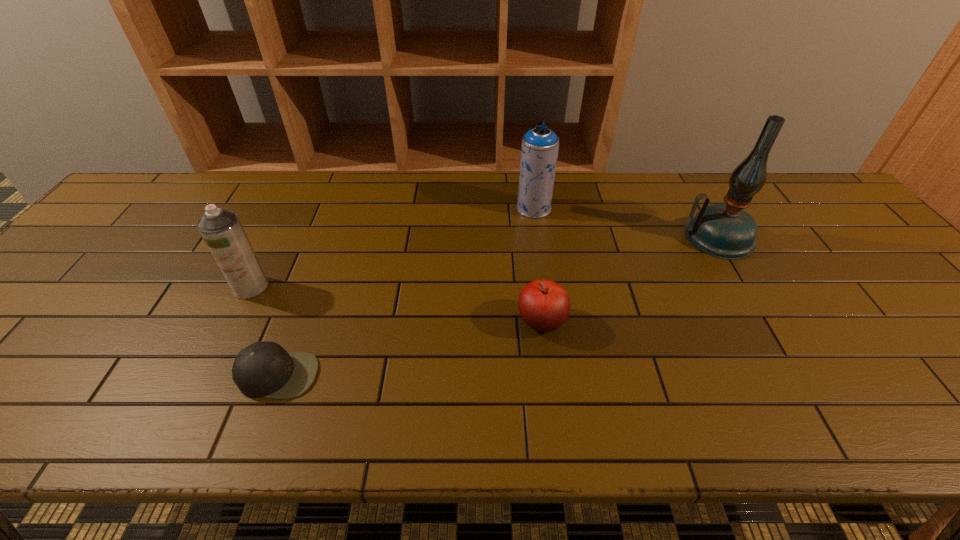
Where is `oil lamp`? The height and width of the screenshot is (540, 960). oil lamp is located at coordinates (726, 231).

Where is `the tallest object`? the tallest object is located at coordinates (726, 231).

Where is `the farther aerosol can`? the farther aerosol can is located at coordinates (539, 151).

Where is `the left aerosol can`? The width and height of the screenshot is (960, 540). the left aerosol can is located at coordinates (222, 231).

Locate an element on the screen. The width and height of the screenshot is (960, 540). the leftmost object is located at coordinates (222, 231).

What are the coordinates of `the fourth farthest object` in the screenshot? It's located at (544, 305).

Locate an element on the screen. This screenshot has height=540, width=960. the second shortest object is located at coordinates (544, 305).

Locate an element on the screen. Image resolution: width=960 pixels, height=540 pixels. cap is located at coordinates (265, 369).

Find the location of a particular element. the shortest object is located at coordinates (265, 369).

Find the location of a particular element. free location located on the left of the oil lamp is located at coordinates (589, 238).